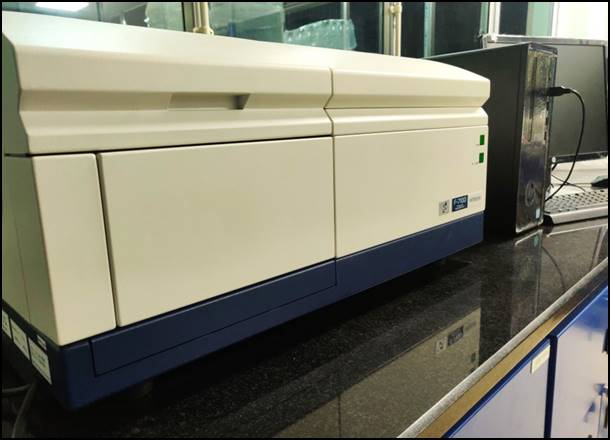
Find the location of `printer`. printer is located at coordinates (304, 201).